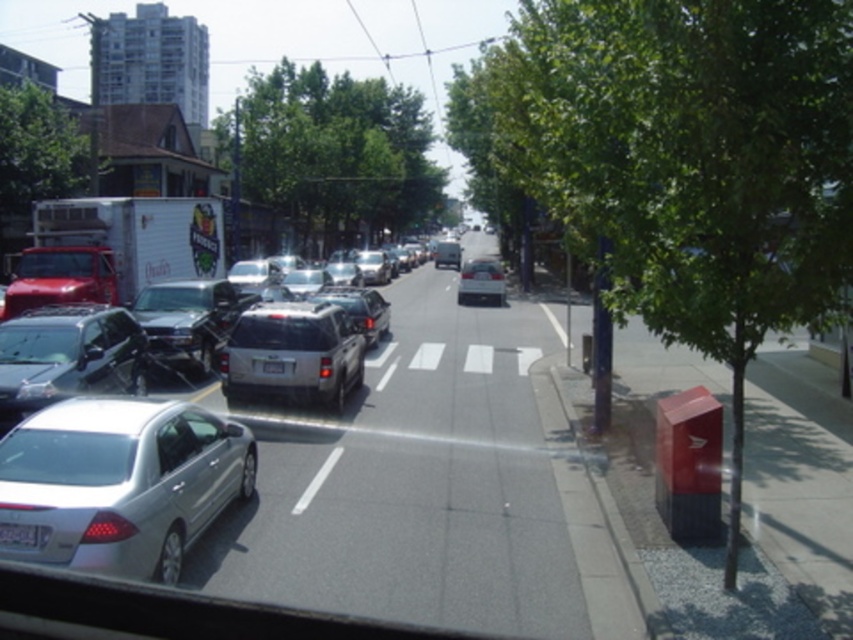
Question: Which point is farther to the camera?

Choices:
 (A) green leafy tree at center
 (B) green leafy tree at right

Answer: (A)

Question: Does green leafy tree at center have a greater width compared to shiny silver sedan at left?

Choices:
 (A) no
 (B) yes

Answer: (B)

Question: Considering the real-world distances, which object is closest to the green leafy tree at right?

Choices:
 (A) green leafy tree at upper left
 (B) satin silver suv at center
 (C) shiny silver sedan at left
 (D) white plastic license plate at lower left

Answer: (B)

Question: Can you confirm if green leafy tree at right is bigger than satin silver suv at center?

Choices:
 (A) no
 (B) yes

Answer: (B)

Question: Is satin silver suv at center bigger than white plastic license plate at lower left?

Choices:
 (A) no
 (B) yes

Answer: (B)

Question: Which object is the farthest from the silver metallic sedan at center-left?

Choices:
 (A) green leafy tree at right
 (B) green leafy tree at center
 (C) white plastic license plate at center

Answer: (B)